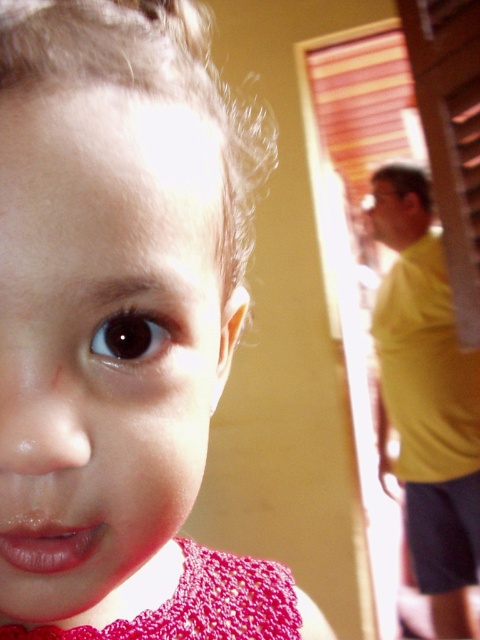
You are a photographer trying to adjust the focus of your camera. You want to ensure both the yellow matte shirt at right and the crochet fabric dress at lower left are in focus. Which object should you focus on first to achieve this?

You should focus on the crochet fabric dress at lower left first because it is closer to the camera than the yellow matte shirt at right, allowing both to be in focus when using depth of field properly.

You are a photographer trying to capture a photo of the child in the matte pink lace dress at center and the man in the yellow matte shirt at right. Based on their positions, which subject is closer to the left side of the frame?

The matte pink lace dress at center is to the left of the yellow matte shirt at right, so the child in the matte pink lace dress at center is closer to the left side of the frame.